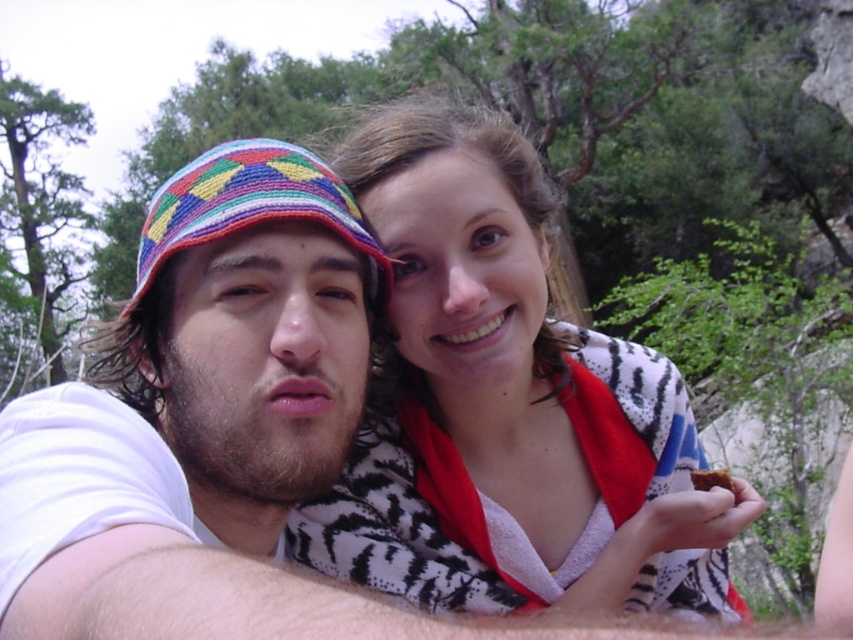
Is beaded fabric hat at left thinner than brown crumbly bread at lower right?

No.

Which is behind, point (274, 186) or point (700, 468)?

Point (700, 468)

Find the location of `beaded fabric hat at left`. beaded fabric hat at left is located at coordinates (252, 208).

Consider the image. Can you confirm if zebra print scarf at center is thinner than brown crumbly bread at lower right?

No, zebra print scarf at center is not thinner than brown crumbly bread at lower right.

Is zebra print scarf at center bigger than brown crumbly bread at lower right?

Yes, zebra print scarf at center is bigger than brown crumbly bread at lower right.

The image size is (853, 640). What do you see at coordinates (509, 406) in the screenshot? I see `zebra print scarf at center` at bounding box center [509, 406].

Where is `zebra print scarf at center`? The image size is (853, 640). zebra print scarf at center is located at coordinates (509, 406).

Is multicolored woven hat at center shorter than brown crumbly bread at lower right?

No.

Between point (274, 536) and point (705, 486), which one is positioned in front?

Point (274, 536)

Between point (316, 483) and point (708, 477), which one is positioned in front?

Point (316, 483) is more forward.

The image size is (853, 640). Identify the location of multicolored woven hat at center. (252, 332).